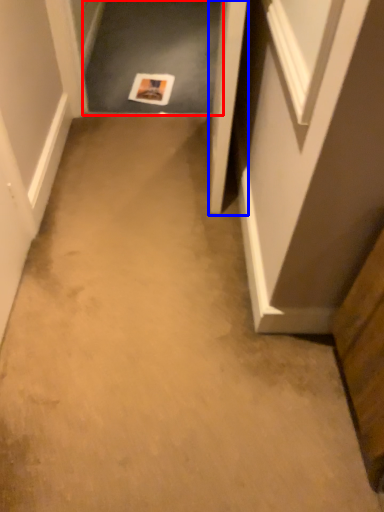
Question: Which of the following is the farthest to the observer, passage (highlighted by a red box) or door (highlighted by a blue box)?

Choices:
 (A) passage
 (B) door

Answer: (A)